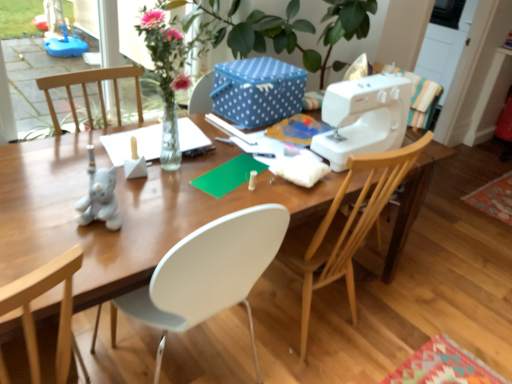
Question: Is white plastic sewing machine at right surrounding blue dotted fabric box at upper center?

Choices:
 (A) no
 (B) yes

Answer: (A)

Question: Is white plastic sewing machine at right in contact with blue dotted fabric box at upper center?

Choices:
 (A) yes
 (B) no

Answer: (B)

Question: From the image's perspective, is white plastic sewing machine at right on blue dotted fabric box at upper center?

Choices:
 (A) no
 (B) yes

Answer: (A)

Question: From a real-world perspective, is white plastic sewing machine at right physically above blue dotted fabric box at upper center?

Choices:
 (A) yes
 (B) no

Answer: (A)

Question: Is white plastic sewing machine at right positioned in front of blue dotted fabric box at upper center?

Choices:
 (A) no
 (B) yes

Answer: (B)

Question: Does white plastic sewing machine at right have a larger size compared to blue dotted fabric box at upper center?

Choices:
 (A) yes
 (B) no

Answer: (A)

Question: Is wooden chair at right thinner than blue dotted fabric box at upper center?

Choices:
 (A) yes
 (B) no

Answer: (B)

Question: From a real-world perspective, is wooden chair at right beneath blue dotted fabric box at upper center?

Choices:
 (A) no
 (B) yes

Answer: (B)

Question: Is wooden chair at right not within blue dotted fabric box at upper center?

Choices:
 (A) no
 (B) yes

Answer: (B)

Question: Is wooden chair at right turned away from blue dotted fabric box at upper center?

Choices:
 (A) no
 (B) yes

Answer: (A)

Question: From the image's perspective, is wooden chair at right on top of blue dotted fabric box at upper center?

Choices:
 (A) yes
 (B) no

Answer: (B)

Question: Is there a large distance between wooden chair at right and blue dotted fabric box at upper center?

Choices:
 (A) yes
 (B) no

Answer: (B)

Question: Is white plastic sewing machine at right at the right side of wooden chair at right?

Choices:
 (A) no
 (B) yes

Answer: (B)